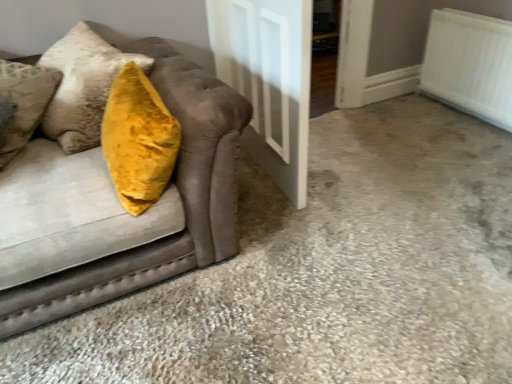
Question: Can you confirm if white textured radiator at upper right is wider than white glossy door at center?

Choices:
 (A) yes
 (B) no

Answer: (B)

Question: Could you tell me if white textured radiator at upper right is turned towards white glossy door at center?

Choices:
 (A) yes
 (B) no

Answer: (A)

Question: Would you consider white textured radiator at upper right to be distant from white glossy door at center?

Choices:
 (A) yes
 (B) no

Answer: (A)

Question: From the image's perspective, is white textured radiator at upper right beneath white glossy door at center?

Choices:
 (A) no
 (B) yes

Answer: (A)

Question: Is white textured radiator at upper right located outside white glossy door at center?

Choices:
 (A) no
 (B) yes

Answer: (B)

Question: Is velvet mustard pillow at left spatially inside white textured radiator at upper right, or outside of it?

Choices:
 (A) outside
 (B) inside

Answer: (A)

Question: Visually, is velvet mustard pillow at left positioned to the left or to the right of white textured radiator at upper right?

Choices:
 (A) right
 (B) left

Answer: (B)

Question: From a real-world perspective, is velvet mustard pillow at left physically located above or below white textured radiator at upper right?

Choices:
 (A) below
 (B) above

Answer: (B)

Question: Does point pos(44,142) appear closer or farther from the camera than point pos(462,23)?

Choices:
 (A) farther
 (B) closer

Answer: (B)

Question: Considering the positions of white textured radiator at upper right and white glossy door at center in the image, is white textured radiator at upper right taller or shorter than white glossy door at center?

Choices:
 (A) short
 (B) tall

Answer: (A)

Question: In terms of size, does white textured radiator at upper right appear bigger or smaller than white glossy door at center?

Choices:
 (A) big
 (B) small

Answer: (B)

Question: Is white textured radiator at upper right in front of or behind white glossy door at center in the image?

Choices:
 (A) behind
 (B) front

Answer: (A)

Question: From a real-world perspective, is white textured radiator at upper right physically located above or below white glossy door at center?

Choices:
 (A) above
 (B) below

Answer: (B)

Question: Do you think white glossy door at center is within velvet mustard pillow at left, or outside of it?

Choices:
 (A) outside
 (B) inside

Answer: (A)

Question: Looking at their shapes, would you say white glossy door at center is wider or thinner than velvet mustard pillow at left?

Choices:
 (A) wide
 (B) thin

Answer: (B)